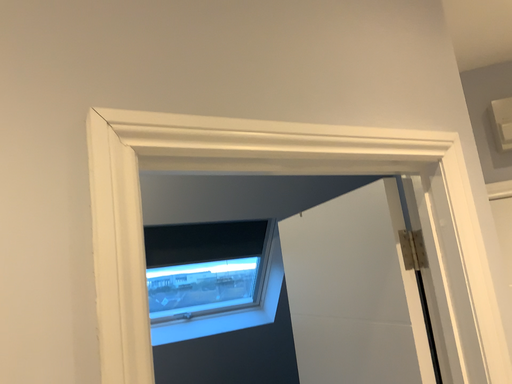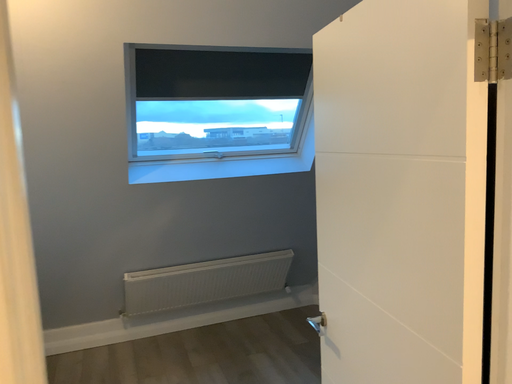
Question: How did the camera likely rotate when shooting the video?

Choices:
 (A) rotated downward
 (B) rotated upward

Answer: (A)